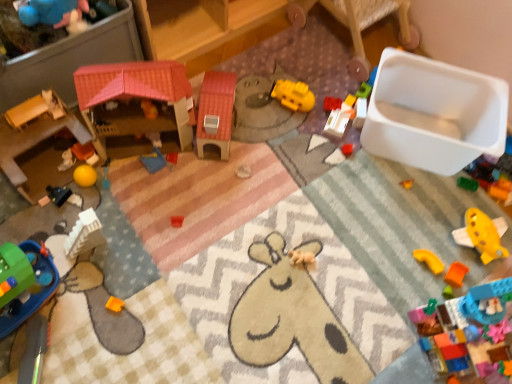
At what (x,y) coordinates should I click in order to perform the action: click on vacant area to the right of blue plastic tray at center, acting as the 6th toy starting from the left. Please return your answer as a coordinate pair (x, y). The image size is (512, 384). Looking at the image, I should click on (197, 175).